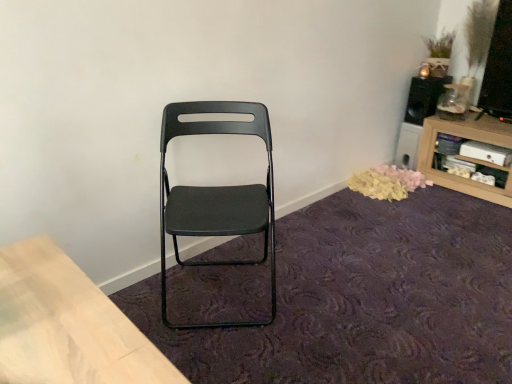
Locate an element on the screen. Image resolution: width=512 pixels, height=384 pixels. matte black folding chair at center is located at coordinates (217, 195).

The height and width of the screenshot is (384, 512). What do you see at coordinates (424, 98) in the screenshot?
I see `black matte speaker at upper right` at bounding box center [424, 98].

Locate an element on the screen. The image size is (512, 384). black fabric chair at center is located at coordinates (365, 298).

Image resolution: width=512 pixels, height=384 pixels. What do you see at coordinates (365, 298) in the screenshot?
I see `black fabric chair at center` at bounding box center [365, 298].

Where is `matte black folding chair at center`? The width and height of the screenshot is (512, 384). matte black folding chair at center is located at coordinates (217, 195).

How many degrees apart are the facing directions of wooden shelf at upper right and matte black folding chair at center?

54.4 degrees.

Would you say wooden shelf at upper right is inside or outside matte black folding chair at center?

wooden shelf at upper right is outside matte black folding chair at center.

Which is nearer, [471,126] or [254,200]?

Point [471,126] appears to be farther away from the viewer than point [254,200].

Based on the photo, from the image's perspective, does wooden shelf at upper right appear higher than matte black folding chair at center?

Yes, from the image's perspective, wooden shelf at upper right is on top of matte black folding chair at center.

Who is bigger, black matte speaker at upper right or matte black folding chair at center?

matte black folding chair at center.

Is black matte speaker at upper right spatially inside matte black folding chair at center, or outside of it?

black matte speaker at upper right is not inside matte black folding chair at center, it's outside.

Measure the distance from black matte speaker at upper right to matte black folding chair at center.

black matte speaker at upper right is 5.33 feet away from matte black folding chair at center.

Can you tell me how much black matte speaker at upper right and matte black folding chair at center differ in facing direction?

There is a 52.1-degree angle between the facing directions of black matte speaker at upper right and matte black folding chair at center.

From the picture: Between black matte speaker at upper right and yellow fabric petals at lower right, which one is positioned behind?

black matte speaker at upper right is further from the camera.

Which of these two, black matte speaker at upper right or yellow fabric petals at lower right, is smaller?

black matte speaker at upper right.

There is a yellow fabric petals at lower right. At what (x,y) coordinates should I click in order to perform the action: click on speaker above it (from a real-world perspective). Please return your answer as a coordinate pair (x, y). The image size is (512, 384). Looking at the image, I should click on (424, 98).

Does black fabric chair at center touch wooden shelf at upper right?

black fabric chair at center and wooden shelf at upper right are clearly separated.

Is black fabric chair at center smaller than wooden shelf at upper right?

Yes.

Choose the correct answer: Is black fabric chair at center inside wooden shelf at upper right or outside it?

black fabric chair at center is not inside wooden shelf at upper right, it's outside.

In the scene shown: Does black fabric chair at center turn towards wooden shelf at upper right?

No, black fabric chair at center is not facing towards wooden shelf at upper right.

Would you consider matte black folding chair at center to be distant from wooden shelf at upper right?

Indeed, matte black folding chair at center is not near wooden shelf at upper right.

Is matte black folding chair at center at the right side of wooden shelf at upper right?

Incorrect, matte black folding chair at center is not on the right side of wooden shelf at upper right.

How much distance is there between matte black folding chair at center and wooden shelf at upper right?

matte black folding chair at center is 5.10 feet away from wooden shelf at upper right.

From the image's perspective, which is below, matte black folding chair at center or wooden shelf at upper right?

matte black folding chair at center is shown below in the image.

Is yellow fabric petals at lower right aimed at wooden shelf at upper right?

No, yellow fabric petals at lower right does not turn towards wooden shelf at upper right.

Which is more to the left, yellow fabric petals at lower right or wooden shelf at upper right?

yellow fabric petals at lower right.

From the image's perspective, between yellow fabric petals at lower right and wooden shelf at upper right, who is located below?

yellow fabric petals at lower right appears lower in the image.

Considering the sizes of yellow fabric petals at lower right and wooden shelf at upper right in the image, is yellow fabric petals at lower right wider or thinner than wooden shelf at upper right?

Considering their sizes, yellow fabric petals at lower right looks slimmer than wooden shelf at upper right.

From the image's perspective, which one is positioned lower, wooden shelf at upper right or black matte speaker at upper right?

wooden shelf at upper right.

Locate an element on the screen. This screenshot has height=384, width=512. speaker lying above the wooden shelf at upper right (from the image's perspective) is located at coordinates (424, 98).

Does wooden shelf at upper right come behind black matte speaker at upper right?

No, wooden shelf at upper right is in front of black matte speaker at upper right.

Which is closer, (489, 129) or (441, 93)?

Positioned in front is point (489, 129).

I want to click on chair on the left of the wooden shelf at upper right, so click(x=217, y=195).

The height and width of the screenshot is (384, 512). Identify the location of chair below the black matte speaker at upper right (from the image's perspective). (217, 195).

Looking at the image, which one is located further to matte black folding chair at center, black matte speaker at upper right or black fabric chair at center?

Based on the image, black matte speaker at upper right appears to be further to matte black folding chair at center.

When comparing their distances from yellow fabric petals at lower right, does wooden shelf at upper right or black fabric chair at center seem further?

Based on the image, black fabric chair at center appears to be further to yellow fabric petals at lower right.

Based on their spatial positions, is black matte speaker at upper right or yellow fabric petals at lower right further from matte black folding chair at center?

Among the two, black matte speaker at upper right is located further to matte black folding chair at center.

Looking at the image, which one is located further to yellow fabric petals at lower right, wooden shelf at upper right or matte black folding chair at center?

matte black folding chair at center lies further to yellow fabric petals at lower right than the other object.

Considering their positions, is matte black folding chair at center positioned further to wooden shelf at upper right than black fabric chair at center?

Among the two, matte black folding chair at center is located further to wooden shelf at upper right.

When comparing their distances from black matte speaker at upper right, does matte black folding chair at center or yellow fabric petals at lower right seem further?

matte black folding chair at center lies further to black matte speaker at upper right than the other object.

Looking at the image, which one is located closer to yellow fabric petals at lower right, matte black folding chair at center or black matte speaker at upper right?

The object closer to yellow fabric petals at lower right is black matte speaker at upper right.

Looking at the image, which one is located closer to wooden shelf at upper right, matte black folding chair at center or yellow fabric petals at lower right?

yellow fabric petals at lower right is closer to wooden shelf at upper right.

This screenshot has width=512, height=384. Identify the location of flower located between matte black folding chair at center and black matte speaker at upper right in the depth direction. (387, 182).

Find the location of `mat between matte black folding chair at center and wooden shelf at upper right in the horizontal direction`. mat between matte black folding chair at center and wooden shelf at upper right in the horizontal direction is located at coordinates (365, 298).

I want to click on speaker between matte black folding chair at center and wooden shelf at upper right from left to right, so click(x=424, y=98).

I want to click on shelf between black fabric chair at center and yellow fabric petals at lower right along the z-axis, so click(466, 156).